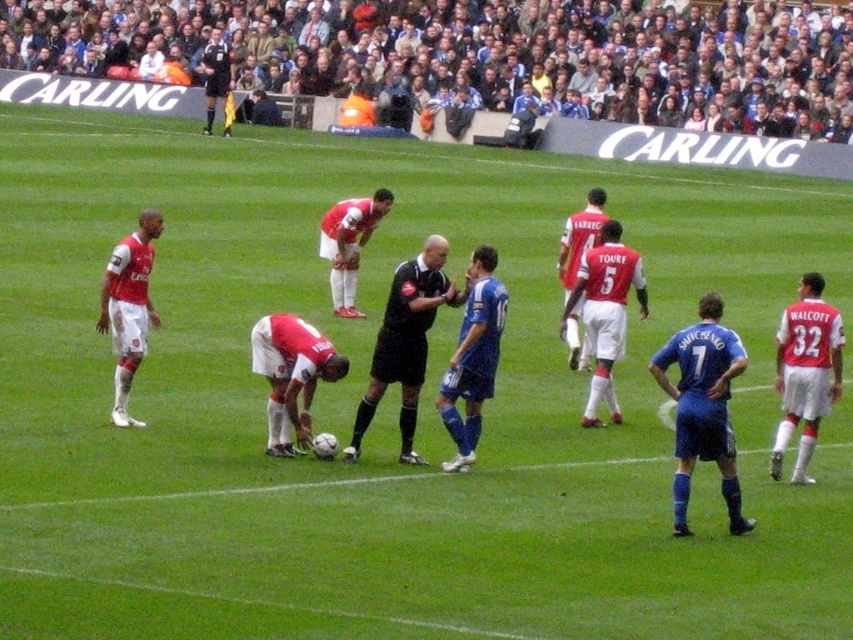
Question: Considering the real-world distances, which object is closest to the white matte jersey at right?

Choices:
 (A) black matte referee at center
 (B) black uniformed official at upper center
 (C) red jersey at center

Answer: (A)

Question: Which object appears farthest from the camera in this image?

Choices:
 (A) white matte jersey at right
 (B) matte red jersey at center
 (C) black matte referee at center
 (D) matte white shorts at center

Answer: (A)

Question: Which object is positioned closest to the white matte soccer player at left?

Choices:
 (A) matte red jersey at center
 (B) red jersey at center

Answer: (A)

Question: Can you confirm if matte red jersey at center is thinner than blue matte jersey at center?

Choices:
 (A) no
 (B) yes

Answer: (A)

Question: Is dark gray fabric crowd at upper center closer to the viewer compared to black uniformed official at upper center?

Choices:
 (A) no
 (B) yes

Answer: (B)

Question: Considering the relative positions of blue matte jersey at center and white matte jersey at right in the image provided, where is blue matte jersey at center located with respect to white matte jersey at right?

Choices:
 (A) left
 (B) right

Answer: (A)